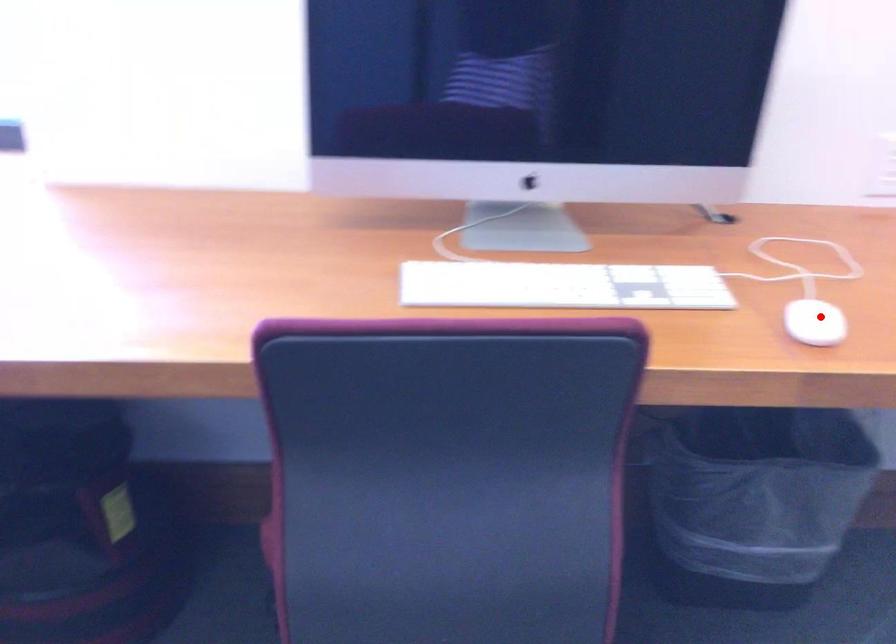
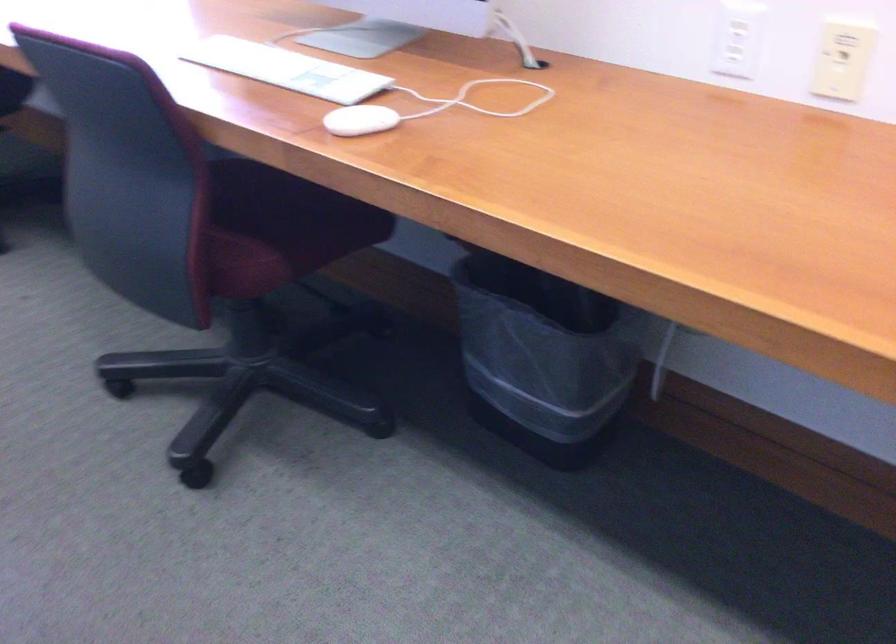
Question: I am providing you with two images of the same scene from different viewpoints. A red point is marked on the first image. Can you still see the location of the red point in image 2?

Choices:
 (A) Yes
 (B) No

Answer: (A)